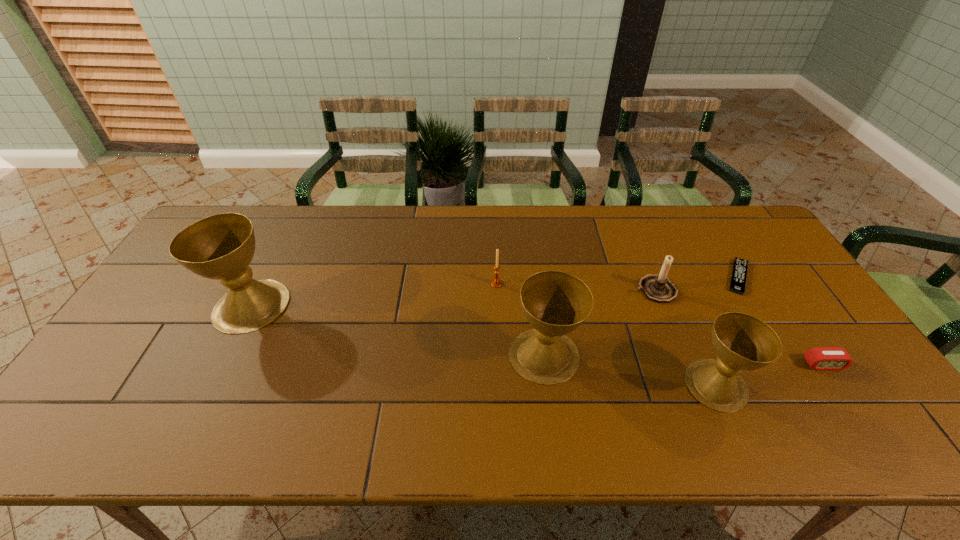
At what (x,y) coordinates should I click in order to perform the action: click on the leftmost object. Please return your answer as a coordinate pair (x, y). This screenshot has height=540, width=960. Looking at the image, I should click on (220, 247).

Locate an element on the screen. the second chalice from left to right is located at coordinates (555, 303).

You are a GUI agent. You are given a task and a screenshot of the screen. Output one action in this format:
    pyautogui.click(x=<x>, y=<y>)
    Task: Click on the fifth object from right to left
    The width and height of the screenshot is (960, 540).
    Given the screenshot: What is the action you would take?
    pyautogui.click(x=555, y=303)

Locate an element on the screen. The height and width of the screenshot is (540, 960). the rightmost chalice is located at coordinates (742, 342).

Where is `the shortest chalice`? the shortest chalice is located at coordinates (742, 342).

What are the coordinates of `the right candle_holder` in the screenshot? It's located at coord(658,288).

At what (x,y) coordinates should I click in order to perform the action: click on remote control. Please return your answer as a coordinate pair (x, y). The image size is (960, 540). Looking at the image, I should click on (738, 280).

You are a GUI agent. You are given a task and a screenshot of the screen. Output one action in this format:
    pyautogui.click(x=<x>, y=<y>)
    Task: Click on the sixth tallest object
    This screenshot has height=540, width=960.
    Given the screenshot: What is the action you would take?
    pyautogui.click(x=820, y=358)

Locate an element on the screen. This screenshot has height=540, width=960. the left candle_holder is located at coordinates (496, 282).

You are a GUI agent. You are given a task and a screenshot of the screen. Output one action in this format:
    pyautogui.click(x=<x>, y=<y>)
    Task: Click on the free space located on the right of the leftmost object
    The image size is (960, 540).
    Given the screenshot: What is the action you would take?
    [x=378, y=306]